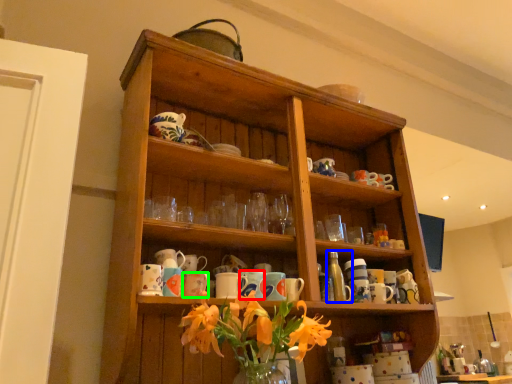
Question: Estimate the real-world distances between objects in this image. Which object is closer to mug (highlighted by a red box), bottle (highlighted by a blue box) or mug (highlighted by a green box)?

Choices:
 (A) bottle
 (B) mug

Answer: (B)